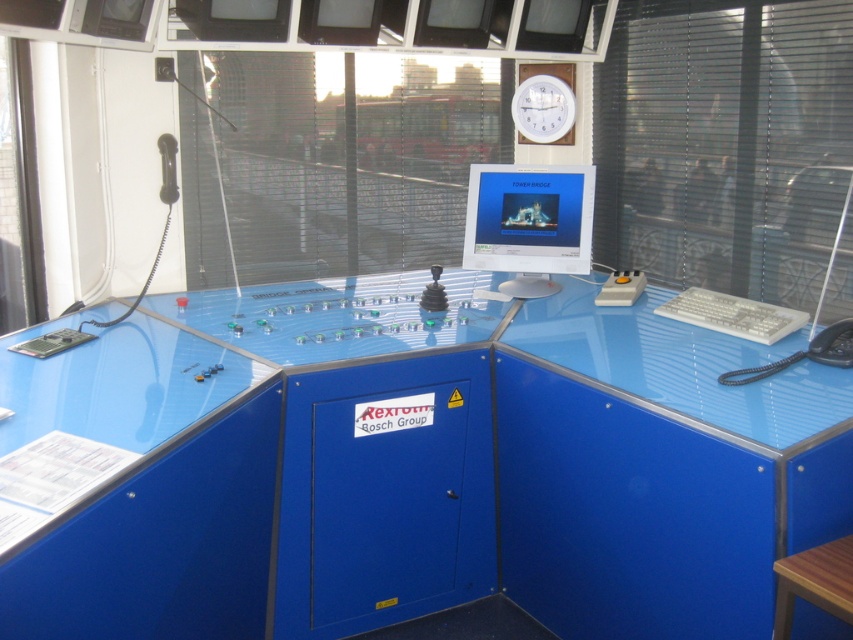
Question: Is wooden stool at lower right to the right of white plastic clock at upper center from the viewer's perspective?

Choices:
 (A) no
 (B) yes

Answer: (B)

Question: Can you confirm if wooden stool at lower right is positioned to the right of white plastic clock at upper center?

Choices:
 (A) yes
 (B) no

Answer: (A)

Question: Which point is farther to the camera?

Choices:
 (A) (517, 90)
 (B) (779, 593)

Answer: (A)

Question: Among these points, which one is farthest from the camera?

Choices:
 (A) (432, 600)
 (B) (519, 253)
 (C) (785, 593)

Answer: (B)

Question: Which of the following is the farthest from the observer?

Choices:
 (A) glossy plastic computer desk at center
 (B) wooden stool at lower right
 (C) white plastic clock at upper center
 (D) white glossy monitor at center

Answer: (C)

Question: Can you confirm if wooden stool at lower right is bigger than white plastic clock at upper center?

Choices:
 (A) no
 (B) yes

Answer: (A)